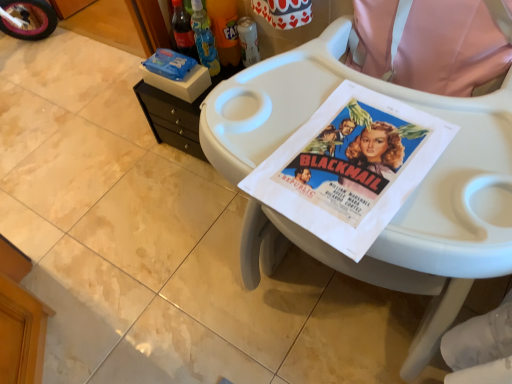
Where is `vacant space that is to the left of white plastic feeding chair at center`? This screenshot has height=384, width=512. vacant space that is to the left of white plastic feeding chair at center is located at coordinates (188, 282).